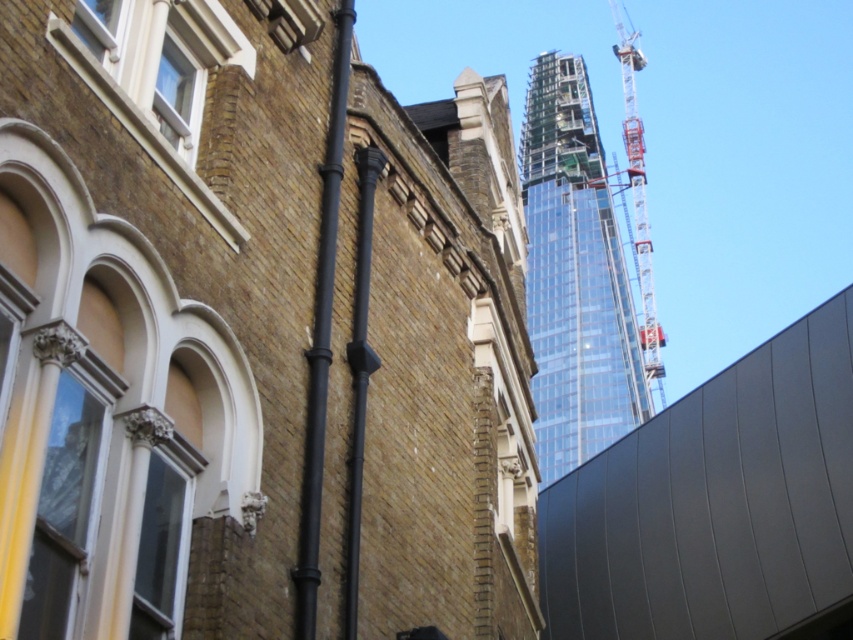
Between black matte pole at center and metallic gray crane at upper right, which one has more height?

metallic gray crane at upper right

Does black matte pole at center appear on the left side of metallic gray crane at upper right?

Indeed, black matte pole at center is positioned on the left side of metallic gray crane at upper right.

Is point (363, 346) closer to camera compared to point (622, 29)?

Yes, it is in front of point (622, 29).

The image size is (853, 640). Find the location of `black matte pole at center`. black matte pole at center is located at coordinates tap(358, 376).

Describe the element at coordinates (575, 275) in the screenshot. Image resolution: width=853 pixels, height=640 pixels. I see `transparent glass tower at upper center` at that location.

Which is above, transparent glass tower at upper center or black matte pole at center?

transparent glass tower at upper center

Between point (618, 436) and point (357, 337), which one is positioned behind?

Point (618, 436)

This screenshot has height=640, width=853. Find the location of `transparent glass tower at upper center`. transparent glass tower at upper center is located at coordinates (575, 275).

Which of these two, black matte pipe at center-left or black matte pole at center, stands taller?

black matte pipe at center-left

Is black matte pipe at center-left smaller than black matte pole at center?

Actually, black matte pipe at center-left might be larger than black matte pole at center.

I want to click on black matte pipe at center-left, so click(321, 339).